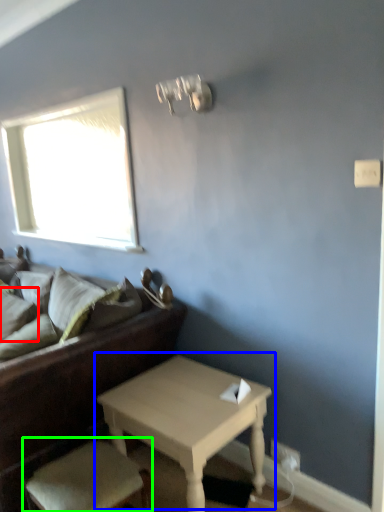
Question: Which object is the closest to the pillow (highlighted by a red box)? Choose among these: table (highlighted by a blue box) or armchair (highlighted by a green box).

Choices:
 (A) table
 (B) armchair

Answer: (B)